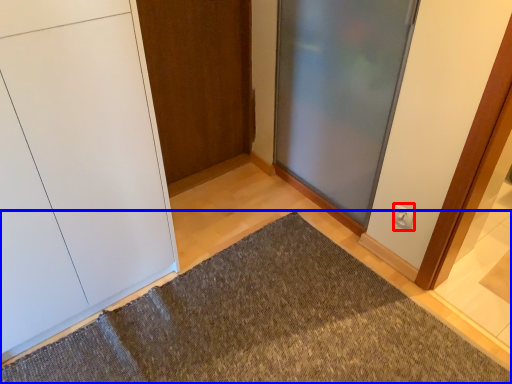
Question: Which object appears closest to the camera in this image, electric outlet (highlighted by a red box) or doormat (highlighted by a blue box)?

Choices:
 (A) electric outlet
 (B) doormat

Answer: (B)